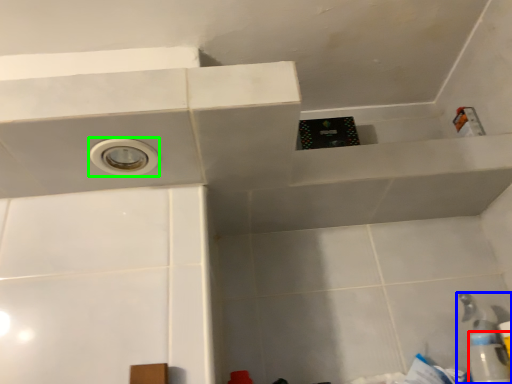
Question: Based on their relative distances, which object is farther from bottle (highlighted by a red box)? Choose from plumbing fixture (highlighted by a blue box) and hole (highlighted by a green box).

Choices:
 (A) plumbing fixture
 (B) hole

Answer: (B)